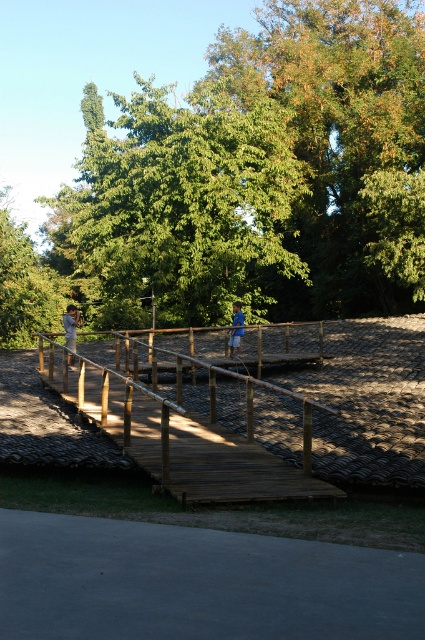
You are a hiker who wants to cross the wooden bridge at center. However, you notice a blue fabric shirt at center in your path. Which object is smaller and might be easier to step over?

The wooden bridge at center is smaller than the blue fabric shirt at center, so it might be easier to step over the wooden bridge at center.

You are standing on the wooden walkway and see a point marked at coordinates (197, 582). According to the scene description, where exactly is this point located?

The point is located on the gray concrete path at lower center.

You are standing on the wooden walkway and notice a person wearing a blue fabric shirt at center and a wooden bridge at center. If you want to pass through the area between them, will there be enough space for you to walk comfortably?

The wooden bridge at center is wider than the blue fabric shirt at center. Since the bridge is wider, there should be sufficient space between them for comfortable passage.